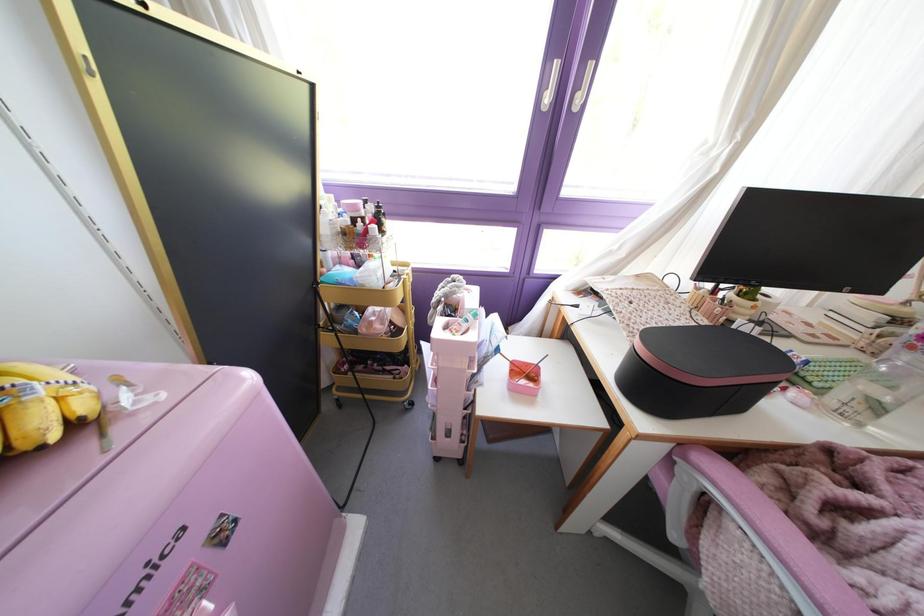
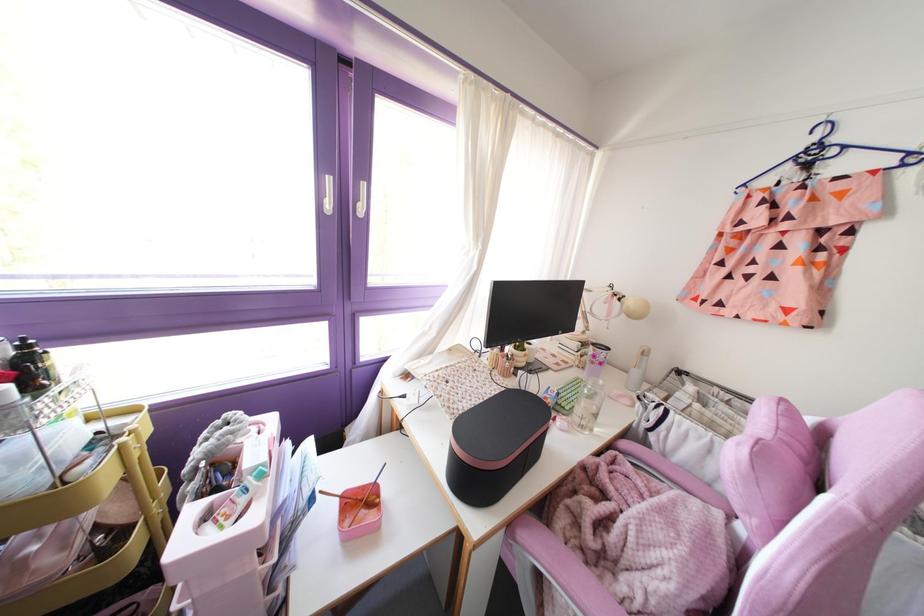
Where in the second image is the point corresponding to [650,334] from the first image?

(459, 426)